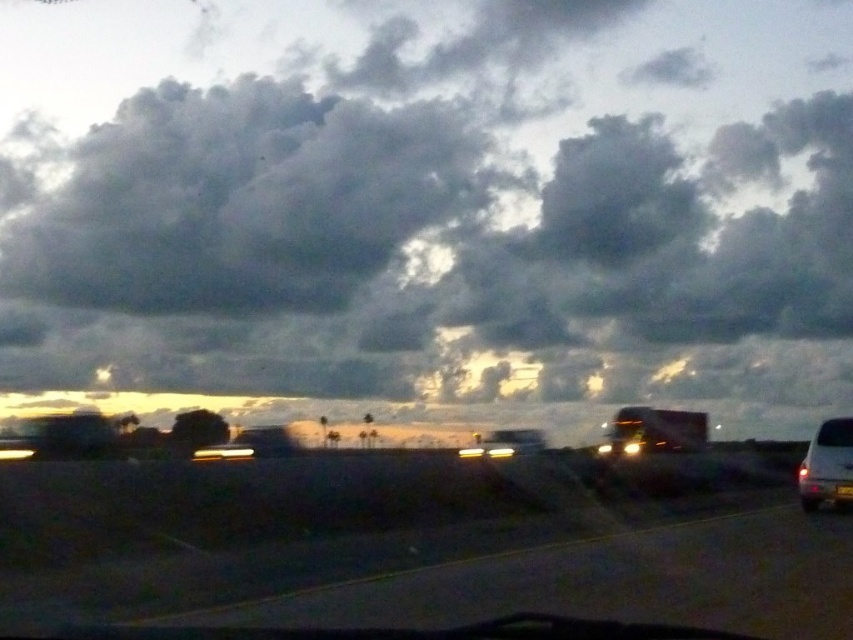
You are a passenger in a car and notice the dark gray cloud at upper center and the transparent glass windshield at lower right. Which object appears wider from your viewpoint?

The dark gray cloud at upper center appears wider than the transparent glass windshield at lower right because its width surpasses the windshield.

Looking at this image, you are a passenger in the car and notice two objects outside the vehicle. One is the dark gray cloud at upper center and the other is the transparent glass windshield at lower right. Which object appears bigger in the scene?

The dark gray cloud at upper center appears bigger than the transparent glass windshield at lower right because it has a larger size compared to it.

You are a drone operator who needs to fly a drone from the dark gray cloud at upper center to the dark asphalt highway at center. Given that the drone has a maximum flight distance of 100 feet, will it be able to reach the highway without needing to recharge?

The dark gray cloud at upper center is 108.12 feet away from the dark asphalt highway at center. Since the drone can only fly up to 100 feet, it will not be able to reach the highway without recharging.